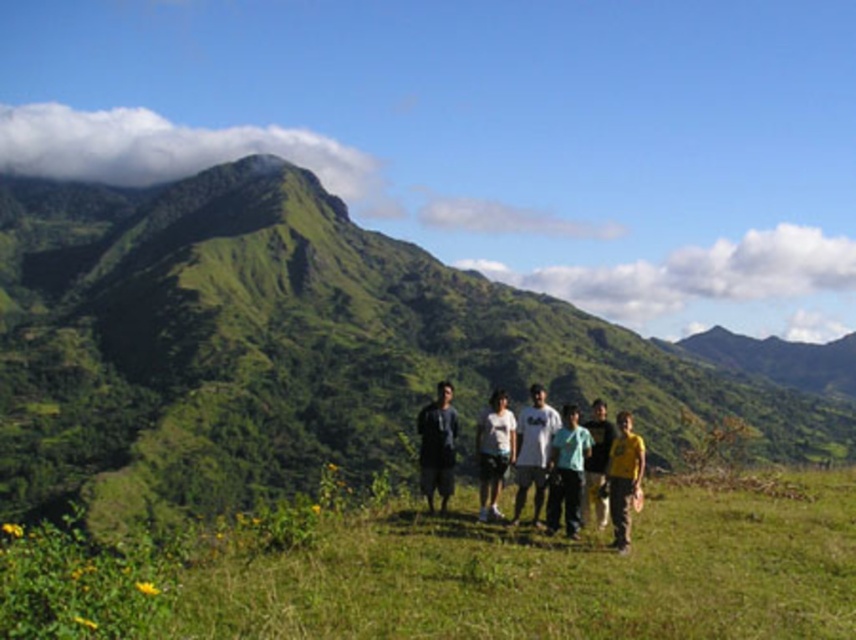
You are a photographer trying to capture a group photo of the white matte shirt at center and the yellow matte shirt at center. Which person should you focus on first if you want to ensure both are in focus, considering their sizes?

You should focus on the white matte shirt at center first because it is larger and requires more precise focusing to ensure clarity, while the yellow matte shirt at center is smaller and may naturally fall into focus.

Looking at this image, you are standing at the point labeled as point (664, 509) on the grassy hillside. A drone is flying above you at an altitude of 30 meters. Can the drone see the central mountain peak that is partially hidden by clouds?

The point labeled as point (664, 509) is 29.65 meters away from the viewer. The drone is flying at 30 meters altitude, so it can see the central mountain peak that is partially hidden by clouds because it is slightly higher than the distance from the point to the viewer.

You are a photographer trying to capture a group photo of the two people wearing the white matte shirt at center and yellow matte shirt at center. Since you want both shirts to be clearly visible in the photo, which person should you position closer to the front to ensure their shirt is not obscured by the other?

The white matte shirt at center should be positioned closer to the front because it has a greater height compared to the yellow matte shirt at center, so placing the taller individual in front will prevent the shorter person from being obscured.